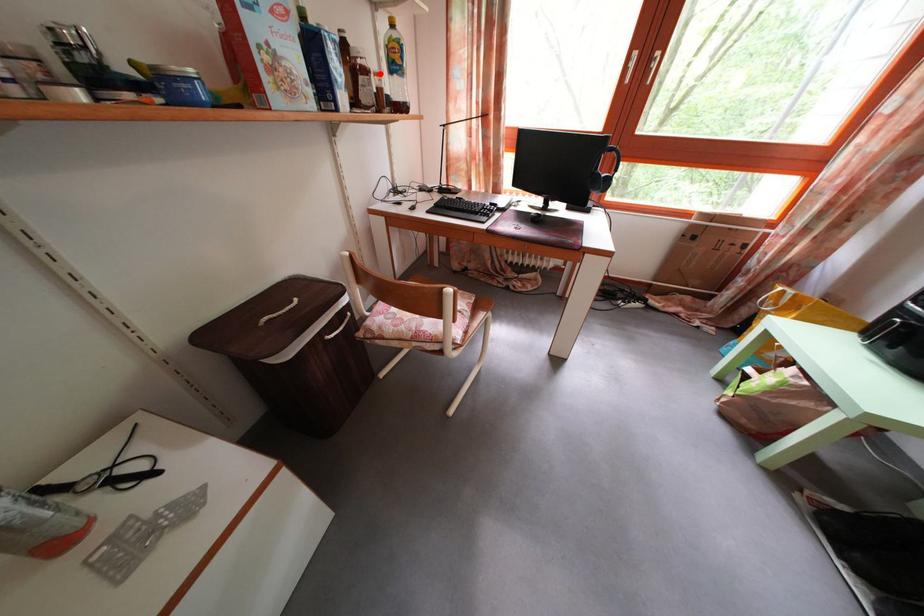
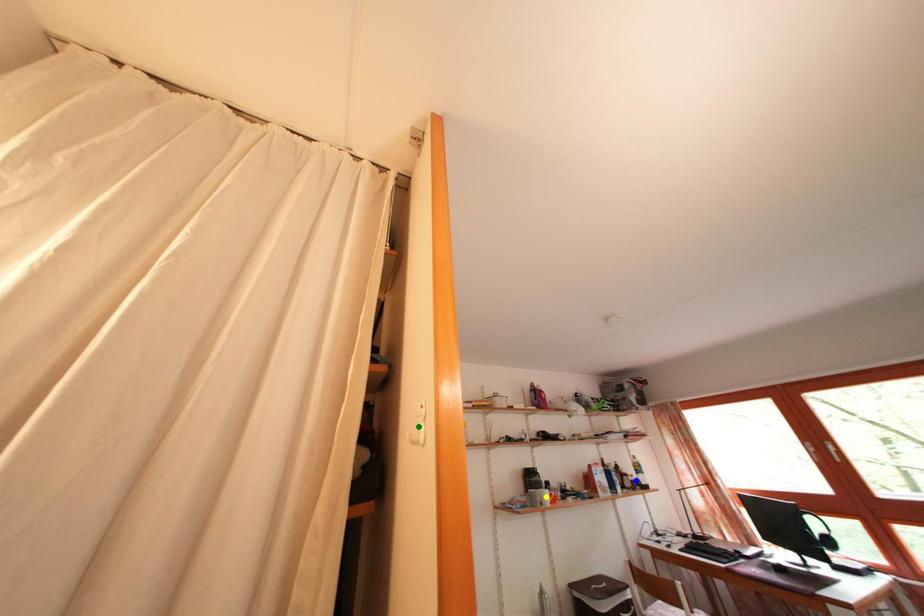
Question: I am providing you with two images of the same scene from different viewpoints. A red point is marked on the first image. You are given multiple points on the second image. Which mark in image 2 goes with the point in image 1?

Choices:
 (A) yellow point
 (B) blue point
 (C) green point

Answer: (B)